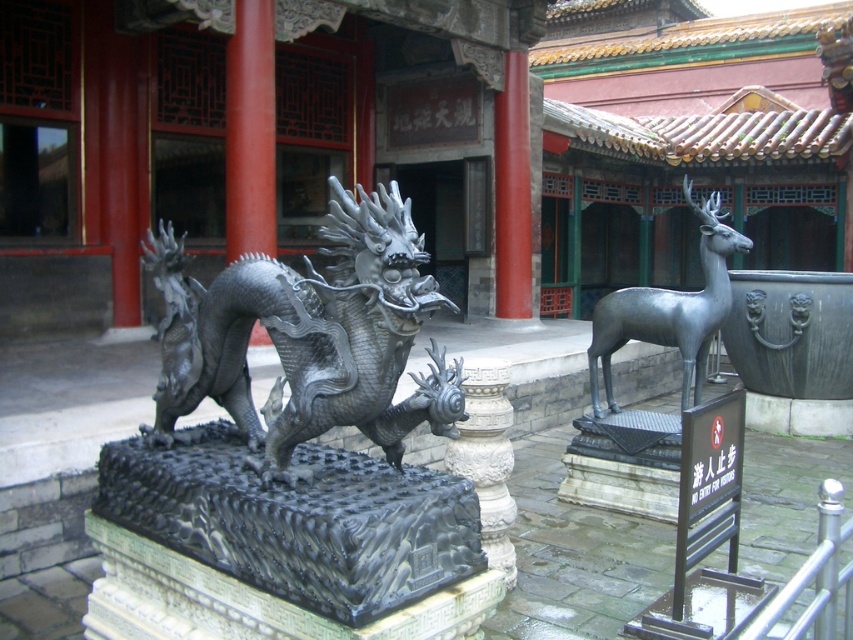
You are an architect designing a new courtyard and want to place a decorative statue between the polished silver dragon at center and the white stone pillar at center. Considering their widths, which object should the statue be placed closer to?

The polished silver dragon at center is wider than the white stone pillar at center. Therefore, the statue should be placed closer to the white stone pillar at center to maintain balance between the two objects.

You are an architect designing a new courtyard and want to place both the polished silver dragon at center and the polished silver deer at center right. Given that the available space is limited, which statue should you prioritize placing first to ensure both can fit?

The polished silver dragon at center occupies less space than the polished silver deer at center right, so you should prioritize placing the polished silver deer at center right first to ensure both can fit.

You are standing in the courtyard and want to place a new decorative item at the exact center of the courtyard. However, there is already an object at point (670, 308). What is the object located at that point?

The object at point (670, 308) is the polished silver deer at center right.